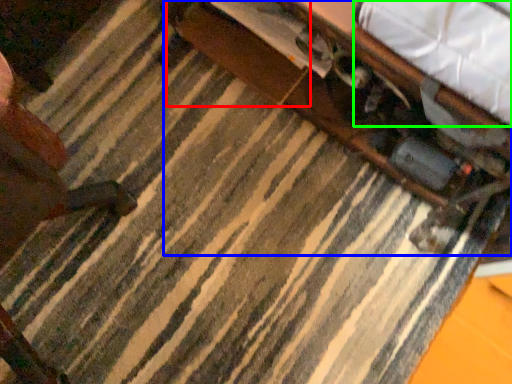
Question: Based on their relative distances, which object is nearer to drawer (highlighted by a red box)? Choose from table (highlighted by a blue box) and sheet (highlighted by a green box).

Choices:
 (A) table
 (B) sheet

Answer: (A)